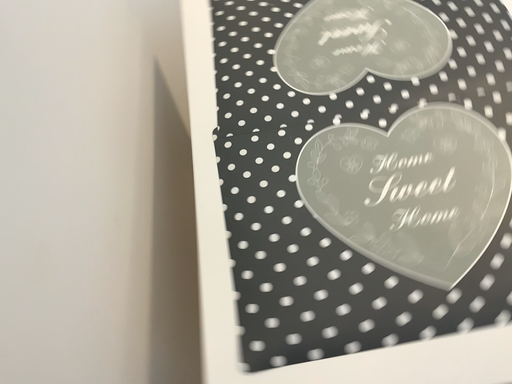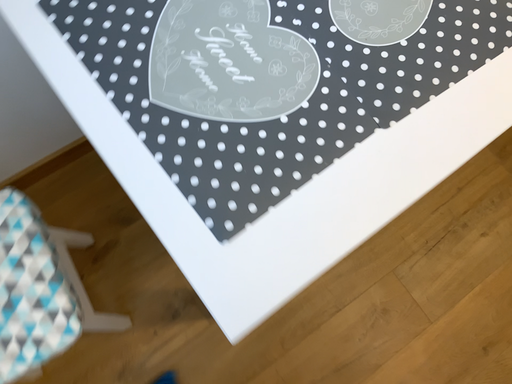
Question: Which way did the camera rotate in the video?

Choices:
 (A) rotated right
 (B) rotated left

Answer: (B)